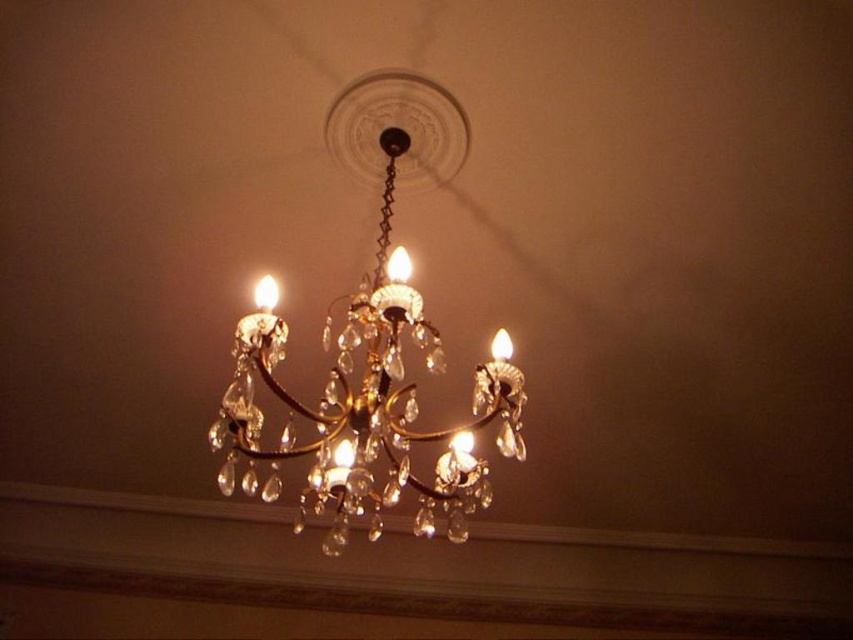
You are standing in a room with a ceiling. You see a gold metallic chandelier at center represented by point (375,349). Where is the gold metallic chandelier at center located in relation to the ceiling?

The gold metallic chandelier at center is located at the center of the ceiling, as it is represented by point (375,349).

You are an interior designer assessing the height of two chandeliers in a room. You see the gold metallic chandelier at center and the matte gold chandelier at center. Which one has a greater height?

The gold metallic chandelier at center is taller than the matte gold chandelier at center.

You are an interior designer planning to hang a new painting between the gold metallic chandelier at center and the matte gold chandelier at center. Which chandelier should the painting be placed closer to if you want it centered between them?

The gold metallic chandelier at center is positioned on the right side of matte gold chandelier at center, so to center the painting between them, it should be placed equidistant from both chandeliers. However, since the gold metallic chandelier at center is to the right of the matte gold chandelier at center, the painting should be placed exactly halfway between their positions.